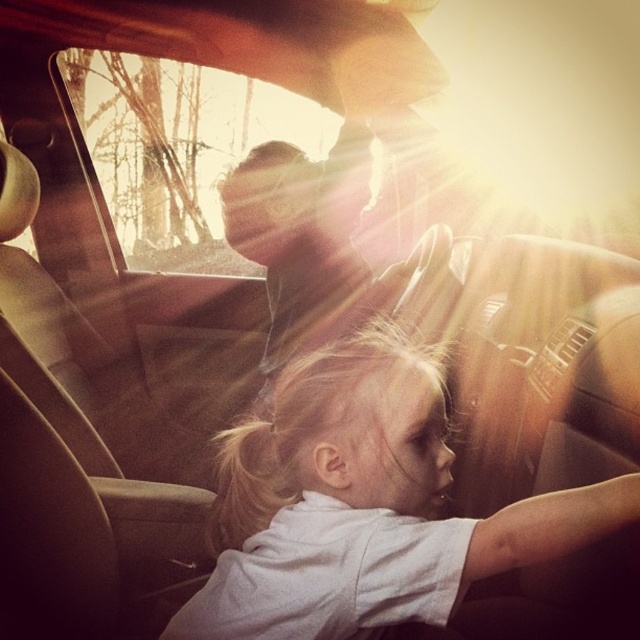
Is white cotton shirt at center taller than transparent glass car window at upper center?

No.

Does point (339, 428) come closer to viewer compared to point (291, 122)?

Yes, point (339, 428) is in front of point (291, 122).

This screenshot has height=640, width=640. What do you see at coordinates (364, 506) in the screenshot? I see `white cotton shirt at center` at bounding box center [364, 506].

Identify the location of white cotton shirt at center. This screenshot has height=640, width=640. [364, 506].